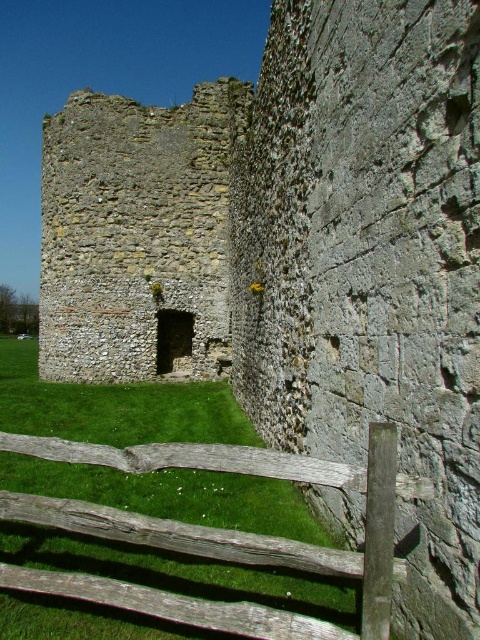
Question: Observing the image, what is the correct spatial positioning of rusty stone ruins at center in reference to weathered wood fence at lower center?

Choices:
 (A) above
 (B) below

Answer: (A)

Question: Does rusty stone ruins at center appear on the left side of weathered wood fence at lower center?

Choices:
 (A) yes
 (B) no

Answer: (A)

Question: Which point is closer to the camera?

Choices:
 (A) rusty stone ruins at center
 (B) weathered wood fence at lower center

Answer: (B)

Question: Is rusty stone ruins at center behind weathered wood fence at lower center?

Choices:
 (A) yes
 (B) no

Answer: (A)